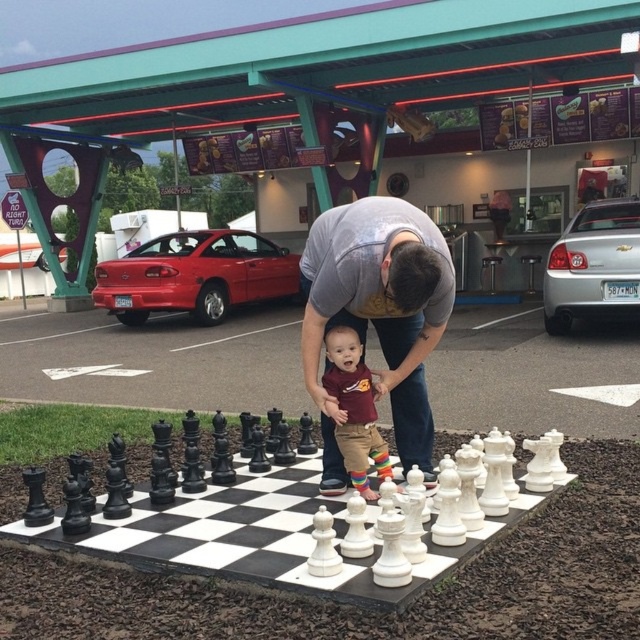
Question: Which of the following is the closest to the observer?

Choices:
 (A) (380, 445)
 (B) (212, 240)
 (C) (396, 332)
 (D) (376, 592)

Answer: (D)

Question: Is black stone chess set at center smaller than maroon jersey at center?

Choices:
 (A) yes
 (B) no

Answer: (B)

Question: Which object is closer to the camera taking this photo?

Choices:
 (A) black stone chess set at center
 (B) maroon jersey at center
 (C) metallic red car at center-left

Answer: (A)

Question: Is metallic red car at center-left bigger than maroon jersey at center?

Choices:
 (A) no
 (B) yes

Answer: (B)

Question: Does metallic red car at center-left come behind maroon jersey at center?

Choices:
 (A) yes
 (B) no

Answer: (A)

Question: Which point appears closest to the camera in this image?

Choices:
 (A) (132, 280)
 (B) (358, 429)
 (C) (317, 262)
 (D) (493, 428)

Answer: (C)